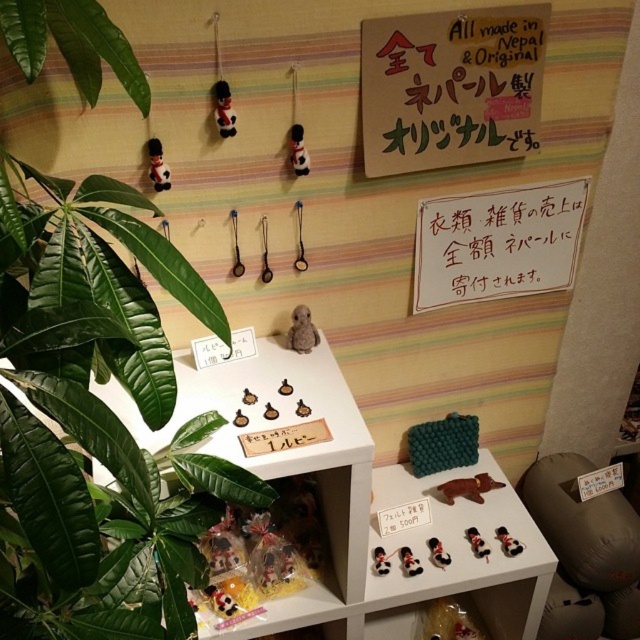
In the scene shown: Is velvet-like plush toy at upper left to the right of brown plush monkey at upper center from the viewer's perspective?

In fact, velvet-like plush toy at upper left is to the left of brown plush monkey at upper center.

Can you confirm if velvet-like plush toy at upper left is positioned to the left of brown plush monkey at upper center?

Correct, you'll find velvet-like plush toy at upper left to the left of brown plush monkey at upper center.

Is point (220, 124) farther from viewer compared to point (289, 390)?

No, (220, 124) is in front of (289, 390).

Where is `velvet-like plush toy at upper left`? The width and height of the screenshot is (640, 640). velvet-like plush toy at upper left is located at coordinates (224, 109).

Consider the image. Is black rubber hair tie at center bigger than brown plush monkey at upper center?

Indeed, black rubber hair tie at center has a larger size compared to brown plush monkey at upper center.

Who is more distant from viewer, [300,252] or [291,385]?

The point [300,252] is behind.

Where is `black rubber hair tie at center`? black rubber hair tie at center is located at coordinates (300, 240).

Can you confirm if matte plastic toy at center is taller than brown plush monkey at upper center?

Indeed, matte plastic toy at center has a greater height compared to brown plush monkey at upper center.

Who is positioned more to the right, matte plastic toy at center or brown plush monkey at upper center?

Positioned to the right is matte plastic toy at center.

What do you see at coordinates (380, 561) in the screenshot?
I see `matte plastic toy at center` at bounding box center [380, 561].

Locate an element on the screen. The height and width of the screenshot is (640, 640). matte plastic toy at center is located at coordinates (380, 561).